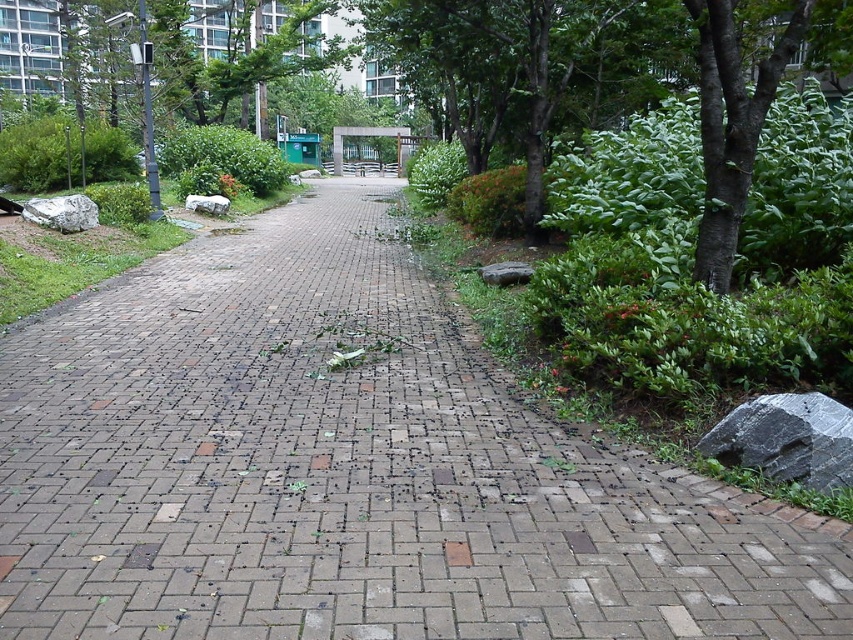
Question: Is gray rough rock at left thinner than metallic silver bus stop at center?

Choices:
 (A) no
 (B) yes

Answer: (B)

Question: Does green plastic bus stop at center appear over gray rough rock at center-right?

Choices:
 (A) no
 (B) yes

Answer: (B)

Question: Considering the real-world distances, which object is farthest from the gray polished rock at lower right?

Choices:
 (A) gray rough rock at center-right
 (B) brick at center
 (C) green plastic bus stop at center

Answer: (C)

Question: Which point is farther to the camera?

Choices:
 (A) metallic silver bus stop at center
 (B) gray rough rock at center-right
 (C) gray rough stone at center
 (D) green plastic bus stop at center

Answer: (A)

Question: Which object is the closest to the gray rough rock at left?

Choices:
 (A) gray polished rock at lower right
 (B) green plastic bus stop at center
 (C) brick at center

Answer: (C)

Question: Is gray polished rock at lower right below metallic silver bus stop at center?

Choices:
 (A) yes
 (B) no

Answer: (A)